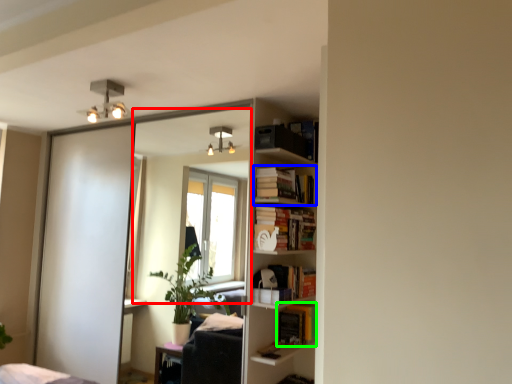
Question: Considering the real-world distances, which object is farthest from mirror (highlighted by a red box)? book (highlighted by a blue box) or book (highlighted by a green box)?

Choices:
 (A) book
 (B) book

Answer: (B)